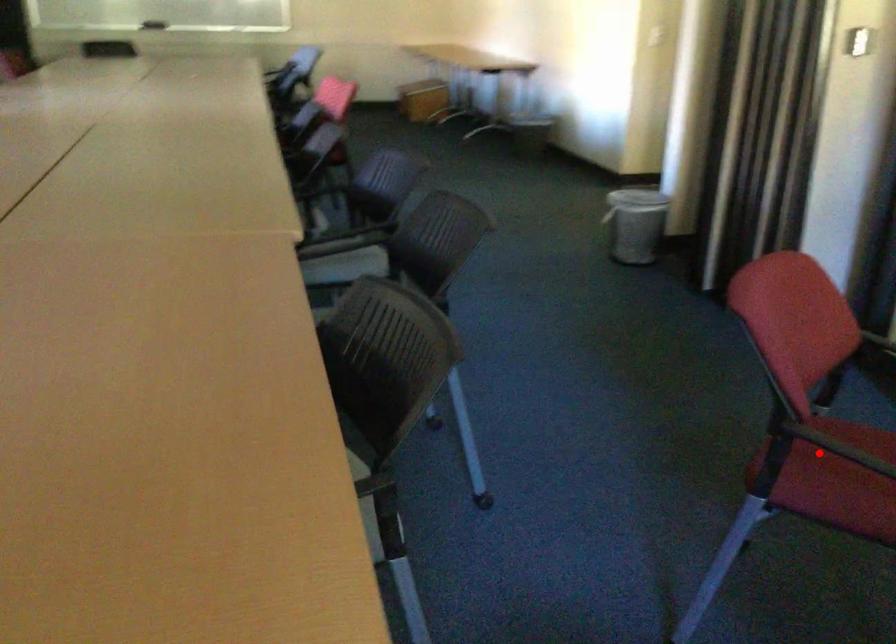
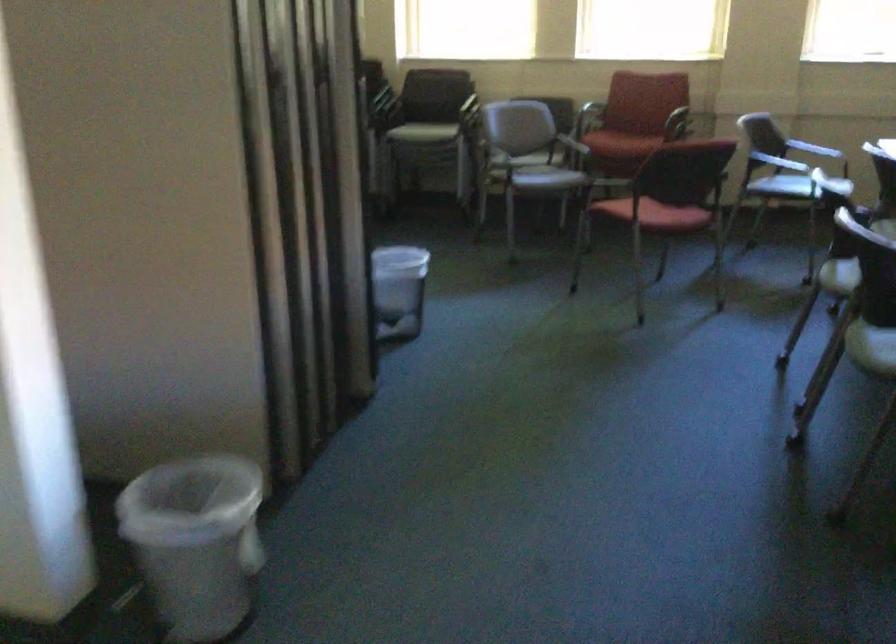
Question: I am providing you with two images of the same scene from different viewpoints. A red point is shown in image1. For the corresponding object point in image2, is it positioned nearer or farther from the camera?

Choices:
 (A) Nearer
 (B) Farther

Answer: (B)